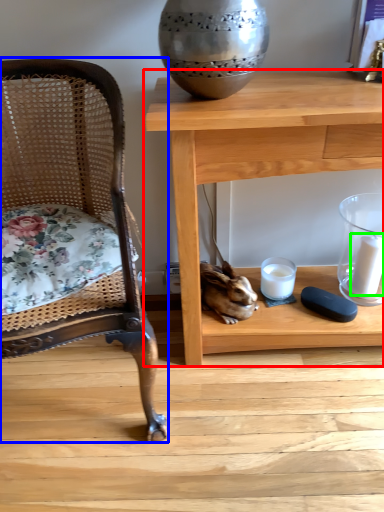
Question: Which is farther away from table (highlighted by a red box)? chair (highlighted by a blue box) or candle (highlighted by a green box)?

Choices:
 (A) chair
 (B) candle

Answer: (B)